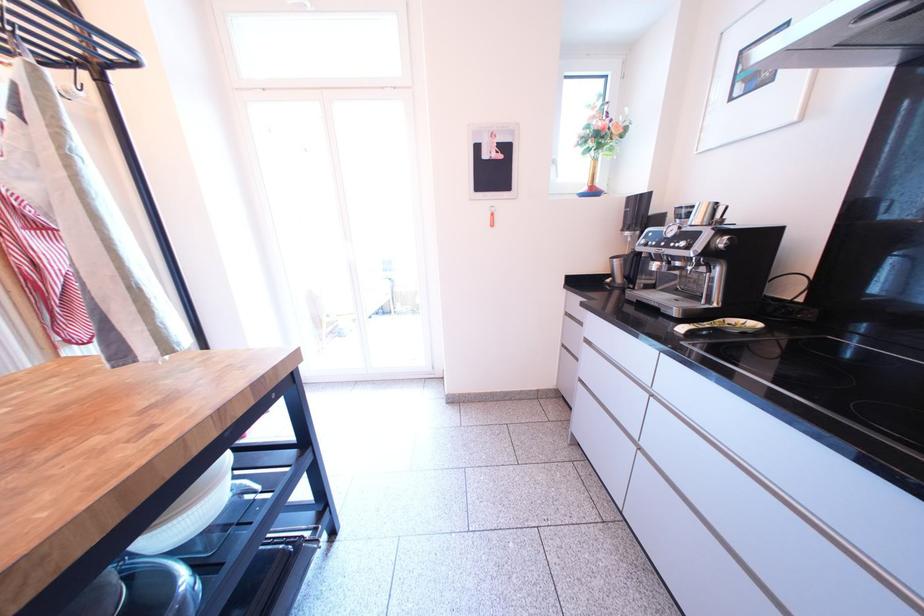
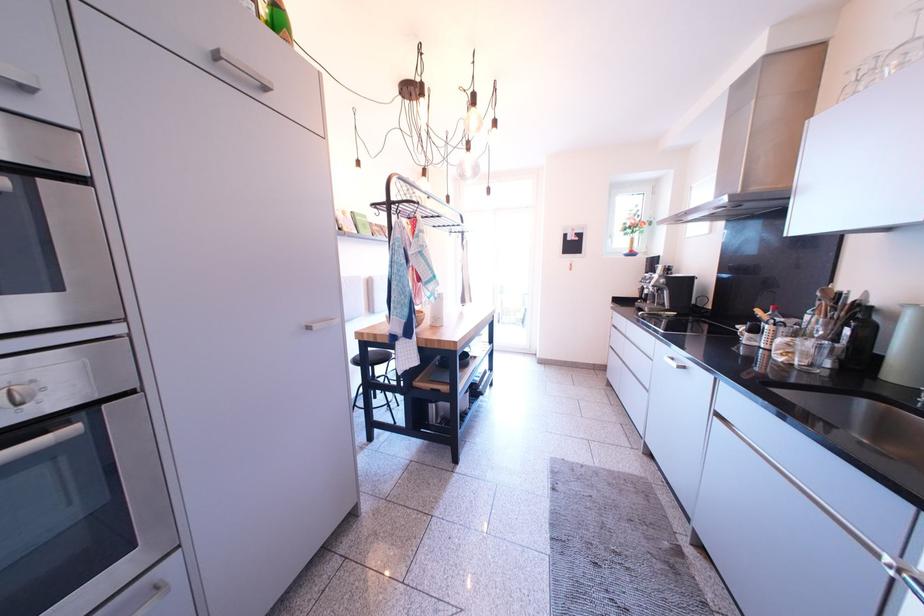
Question: Which direction would the cameraman need to move to produce the second image? Reply with the corresponding letter.

Choices:
 (A) Left
 (B) Right
 (C) Forward
 (D) Backward

Answer: (D)